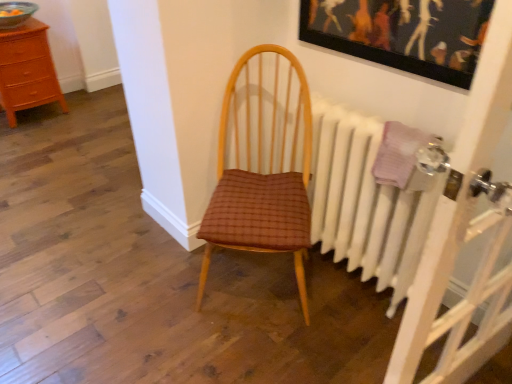
Locate an element on the screen. The image size is (512, 384). vacant area that is in front of brown woven fabric chair at center is located at coordinates (255, 351).